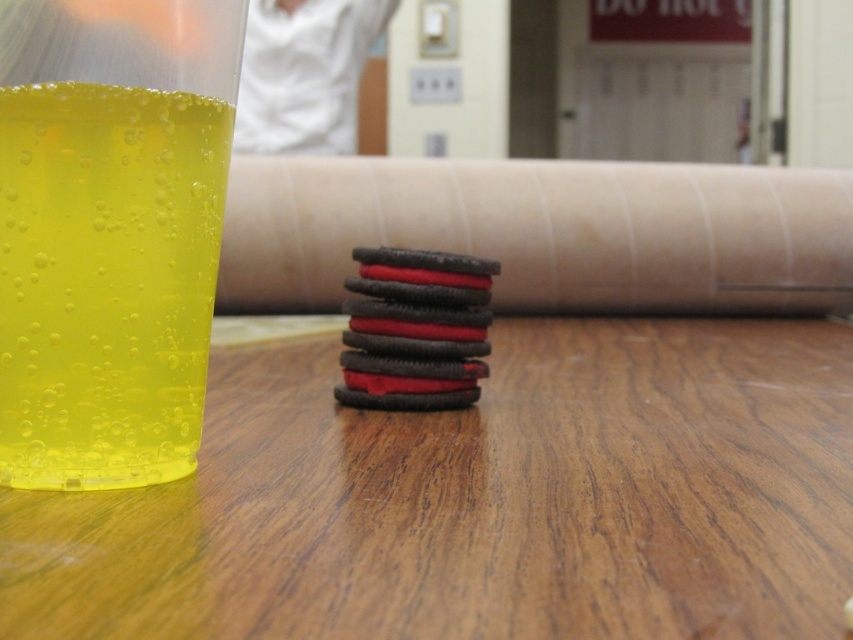
You are a photographer setting up a shot for a food advertisement. You need to place a camera 25 centimeters away from the wooden table at center to achieve the desired focus. Is the current distance sufficient for your setup?

The wooden table at center is currently 24.02 centimeters away from the viewer, which is slightly less than the required 25 centimeters. To meet the requirement, you need to move the camera back approximately 0.98 centimeters.

You are setting up a small snack area and need to place both the wooden table at center and the translucent yellow liquid at left. Given their sizes, which object should you prioritize placing first to ensure there is enough space for both?

The wooden table at center has a larger size compared to the translucent yellow liquid at left, so you should prioritize placing the wooden table at center first to ensure there is enough space for both.